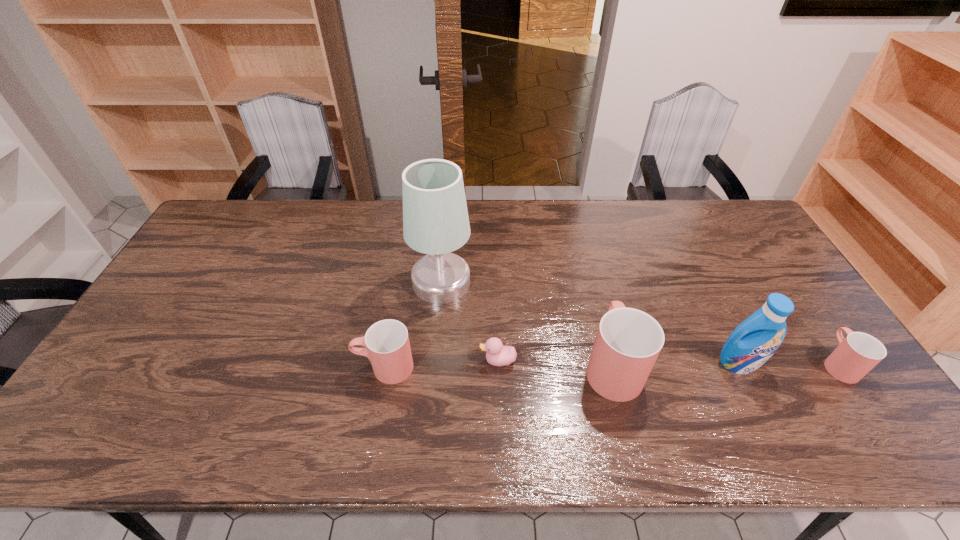
In order to click on the shortest object in this screenshot , I will do `click(496, 354)`.

Locate an element on the screen. The width and height of the screenshot is (960, 540). duckling is located at coordinates (496, 354).

Locate an element on the screen. vacant region located 0.190m on the side of the second shortest cup with the handle is located at coordinates (282, 367).

Identify the location of vacant region located on the side of the second shortest cup with the handle. click(x=309, y=367).

This screenshot has height=540, width=960. Find the location of `free space located on the side of the second shortest cup with the handle`. free space located on the side of the second shortest cup with the handle is located at coordinates (232, 367).

In order to click on free space located on the side of the fourth object from left to right with the handle in this screenshot , I will do `click(584, 250)`.

I want to click on blank area located on the side of the fourth object from left to right with the handle, so click(587, 262).

You are a GUI agent. You are given a task and a screenshot of the screen. Output one action in this format:
    pyautogui.click(x=<x>, y=<y>)
    Task: Click on the blank space located 0.400m on the side of the fourth object from left to right with the handle
    
    Given the screenshot: What is the action you would take?
    pyautogui.click(x=581, y=240)

Identify the location of vacant space located on the side of the fifth tallest object with the handle. (806, 316).

You are a GUI agent. You are given a task and a screenshot of the screen. Output one action in this format:
    pyautogui.click(x=<x>, y=<y>)
    Task: Click on the blank area located 0.330m on the side of the fifth tallest object with the handle
    The width and height of the screenshot is (960, 540).
    Given the screenshot: What is the action you would take?
    pyautogui.click(x=769, y=262)